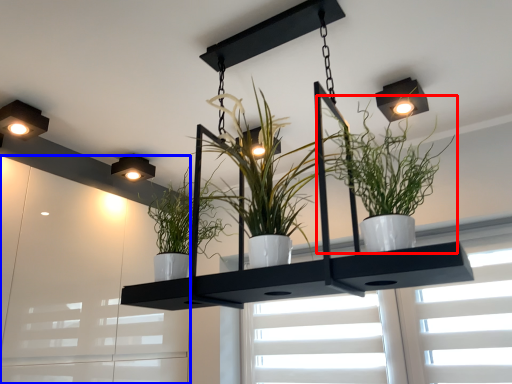
Question: Among these objects, which one is nearest to the camera, houseplant (highlighted by a red box) or window frame (highlighted by a blue box)?

Choices:
 (A) houseplant
 (B) window frame

Answer: (A)